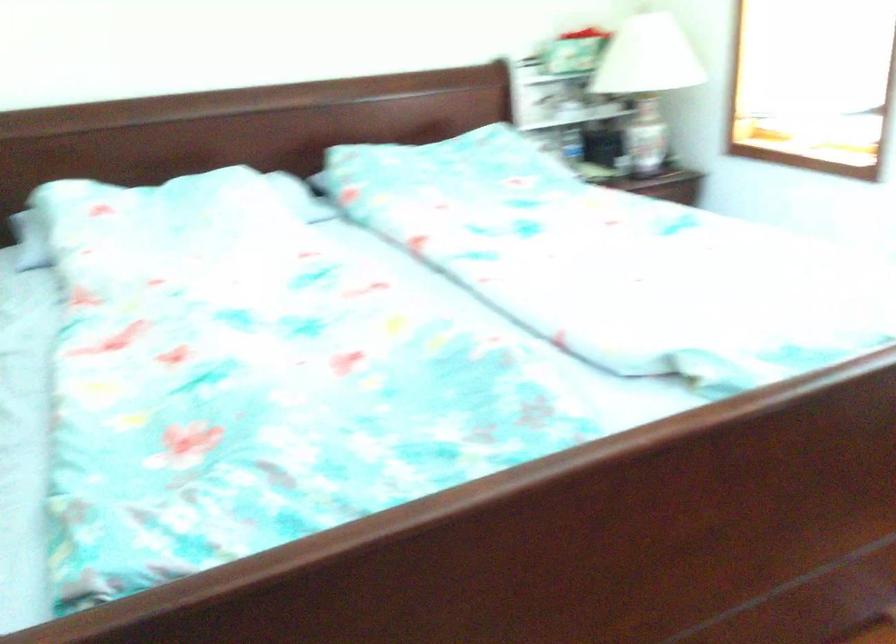
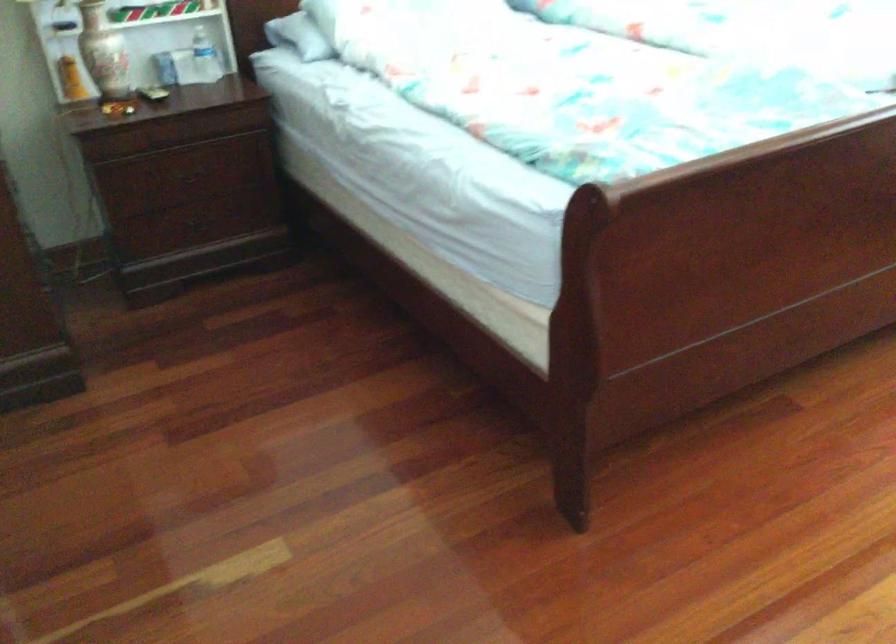
Question: Based on the continuous images, in which direction is the camera rotating? Reply with the corresponding letter.

Choices:
 (A) Left
 (B) Right
 (C) Up
 (D) Down

Answer: (D)